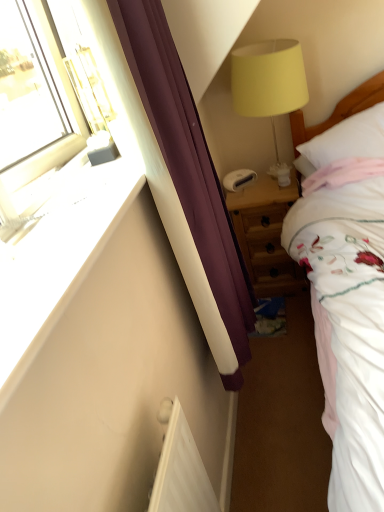
Question: From the image's perspective, is white smooth wall at left on wooden nightstand at center?

Choices:
 (A) yes
 (B) no

Answer: (B)

Question: Is white smooth wall at left positioned before wooden nightstand at center?

Choices:
 (A) yes
 (B) no

Answer: (A)

Question: Is white smooth wall at left positioned with its back to wooden nightstand at center?

Choices:
 (A) yes
 (B) no

Answer: (B)

Question: Is white smooth wall at left facing towards wooden nightstand at center?

Choices:
 (A) no
 (B) yes

Answer: (A)

Question: From a real-world perspective, does white smooth wall at left stand above wooden nightstand at center?

Choices:
 (A) yes
 (B) no

Answer: (A)

Question: Is white smooth wall at left wider or thinner than white soft pillow at right?

Choices:
 (A) wide
 (B) thin

Answer: (B)

Question: From the image's perspective, is white smooth wall at left above or below white soft pillow at right?

Choices:
 (A) below
 (B) above

Answer: (A)

Question: Considering the positions of white smooth wall at left and white soft pillow at right in the image, is white smooth wall at left taller or shorter than white soft pillow at right?

Choices:
 (A) short
 (B) tall

Answer: (A)

Question: Looking at the image, does white smooth wall at left seem bigger or smaller compared to white soft pillow at right?

Choices:
 (A) big
 (B) small

Answer: (B)

Question: From a real-world perspective, is white soft pillow at right physically located above or below yellow fabric lampshade at upper right?

Choices:
 (A) above
 (B) below

Answer: (B)

Question: Considering the positions of white soft pillow at right and yellow fabric lampshade at upper right in the image, is white soft pillow at right bigger or smaller than yellow fabric lampshade at upper right?

Choices:
 (A) big
 (B) small

Answer: (B)

Question: Considering the positions of white soft pillow at right and yellow fabric lampshade at upper right in the image, is white soft pillow at right wider or thinner than yellow fabric lampshade at upper right?

Choices:
 (A) thin
 (B) wide

Answer: (B)

Question: Is white soft pillow at right to the left or to the right of yellow fabric lampshade at upper right in the image?

Choices:
 (A) right
 (B) left

Answer: (A)

Question: Looking at their shapes, would you say purple fabric curtain at left is wider or thinner than white smooth wall at left?

Choices:
 (A) thin
 (B) wide

Answer: (B)

Question: From a real-world perspective, is purple fabric curtain at left physically located above or below white smooth wall at left?

Choices:
 (A) below
 (B) above

Answer: (A)